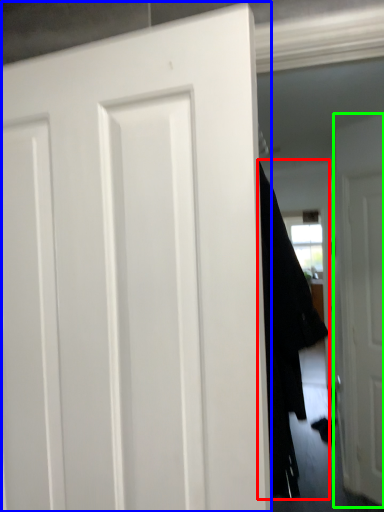
Question: Based on their relative distances, which object is farther from garment (highlighted by a red box)? Choose from door (highlighted by a blue box) and door (highlighted by a green box).

Choices:
 (A) door
 (B) door

Answer: (B)